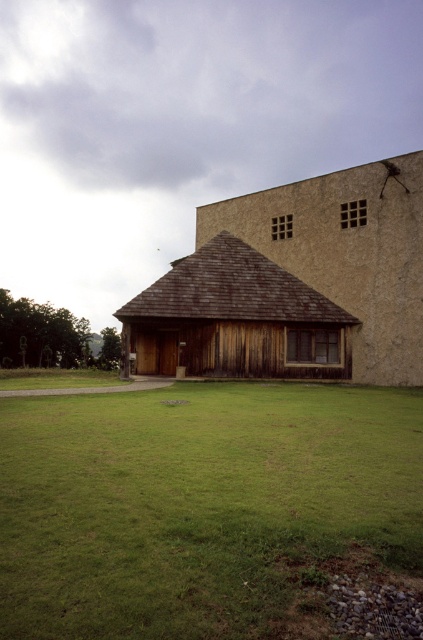
Is point (21, 586) in front of point (143, 337)?

That is True.

Locate an element on the screen. This screenshot has height=640, width=423. green grass at center is located at coordinates [205, 508].